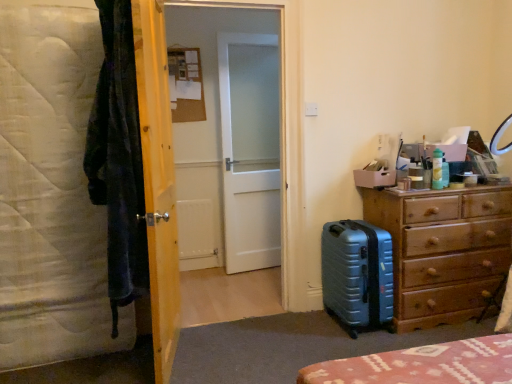
At what (x,y) coordinates should I click in order to perform the action: click on vacant area that lies to the right of wooden door at center. Please return your answer as a coordinate pair (x, y). Looking at the image, I should click on (247, 348).